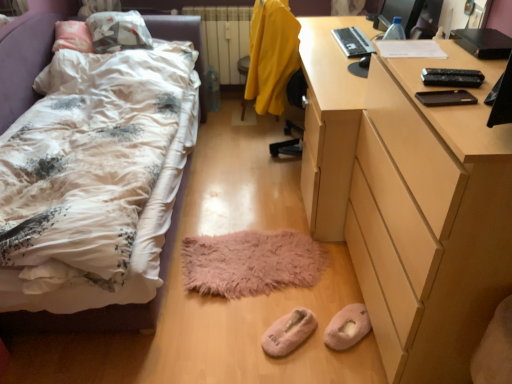
Where is `free space below black plastic laptop at upper right (from a real-world perspective)`? free space below black plastic laptop at upper right (from a real-world perspective) is located at coordinates (353, 37).